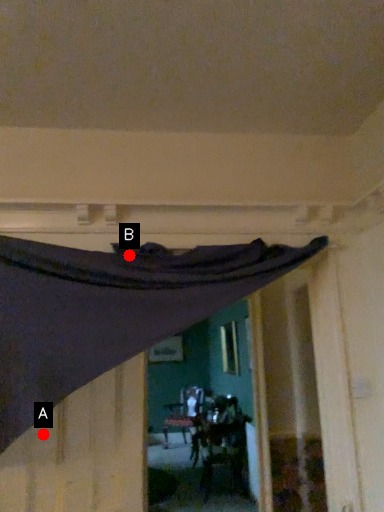
Question: Two points are circled on the image, labeled by A and B beside each circle. Which point is closer to the camera?

Choices:
 (A) A is closer
 (B) B is closer

Answer: (A)